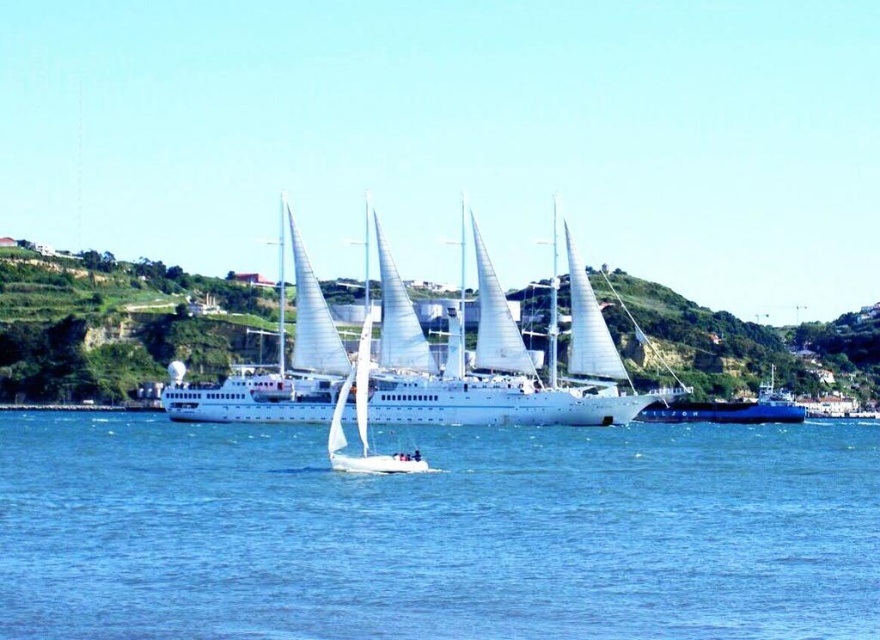
Question: Can you confirm if white glossy ship at center is thinner than white matte sailboat at center?

Choices:
 (A) no
 (B) yes

Answer: (A)

Question: Which of these objects is positioned farthest from the blue matte ship at center?

Choices:
 (A) blue water at center
 (B) white matte sailboat at center

Answer: (B)

Question: Observing the image, what is the correct spatial positioning of blue water at center in reference to white glossy ship at center?

Choices:
 (A) above
 (B) below

Answer: (B)

Question: Which point is farther to the camera?

Choices:
 (A) blue matte ship at center
 (B) blue water at center
 (C) white matte sailboat at center

Answer: (A)

Question: Which point is farther to the camera?

Choices:
 (A) white matte sailboat at center
 (B) blue matte ship at center

Answer: (B)

Question: Can you confirm if blue water at center is wider than blue matte ship at center?

Choices:
 (A) yes
 (B) no

Answer: (A)